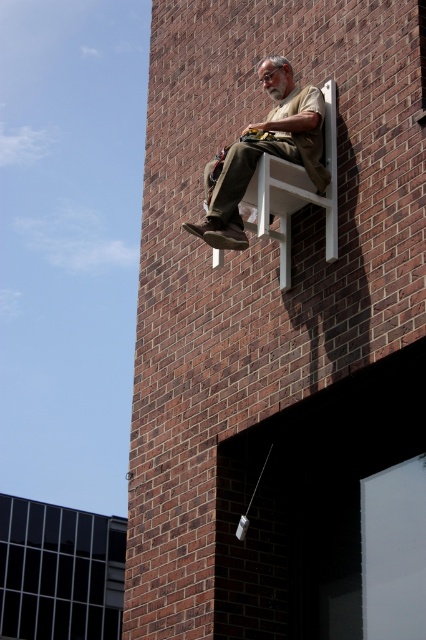
You are an interior designer assessing the space in the image. You need to determine if a large poster that is 2 feet wide can fit on the clear glass window at lower left without overlapping the khaki cotton pants at upper center. Can it fit?

The clear glass window at lower left is bigger than the khaki cotton pants at upper center. Since the window is larger, the 2 feet wide poster can fit on the clear glass window at lower left without overlapping the khaki cotton pants at upper center.

Based on the photo, you are a window cleaner standing on the ground outside the building. You need to clean the clear glass window at lower left without disturbing the man in khaki cotton pants at upper center. Can you safely reach the window from below?

The clear glass window at lower left is below the khaki cotton pants at upper center, so you can safely clean the window from below without disturbing the man.

You are standing at the origin point in the image. You see two points labeled as point [17,596] and point [279,58]. Which point is closer to you?

Point [279,58] is closer to you because it is in front of point [17,596].